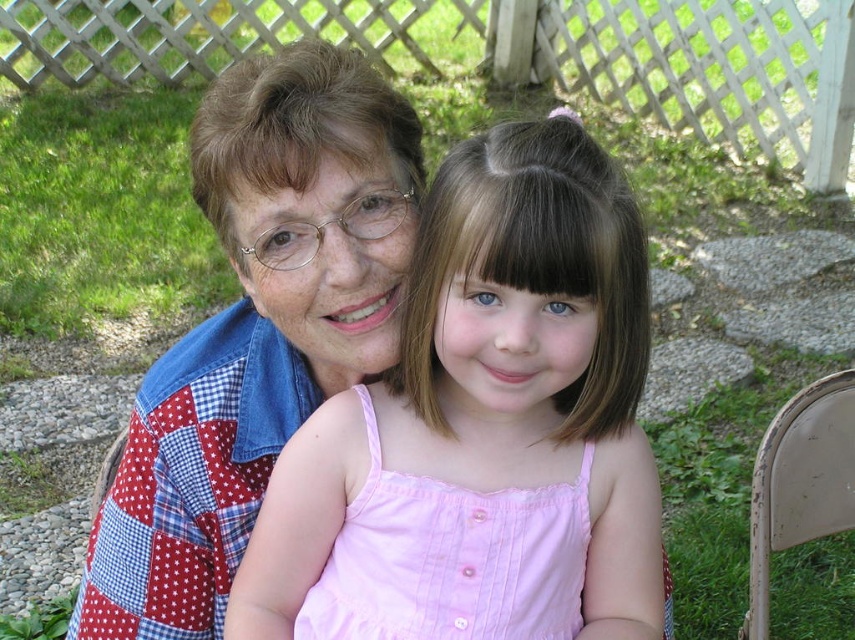
Question: Considering the real-world distances, which object is farthest from the beige plastic chair at lower right?

Choices:
 (A) patchwork quilt at center
 (B) pink cotton dress at center

Answer: (A)

Question: Does pink fabric dress at center lie behind pink cotton dress at center?

Choices:
 (A) no
 (B) yes

Answer: (A)

Question: Can you confirm if pink fabric dress at center is wider than beige plastic chair at lower right?

Choices:
 (A) yes
 (B) no

Answer: (A)

Question: In this image, where is pink fabric dress at center located relative to patchwork quilt at center?

Choices:
 (A) below
 (B) above

Answer: (A)

Question: Which object is closer to the camera taking this photo?

Choices:
 (A) beige plastic chair at lower right
 (B) pink cotton dress at center

Answer: (B)

Question: Which is nearer to the patchwork quilt at center?

Choices:
 (A) beige plastic chair at lower right
 (B) pink cotton dress at center
 (C) pink fabric dress at center

Answer: (C)